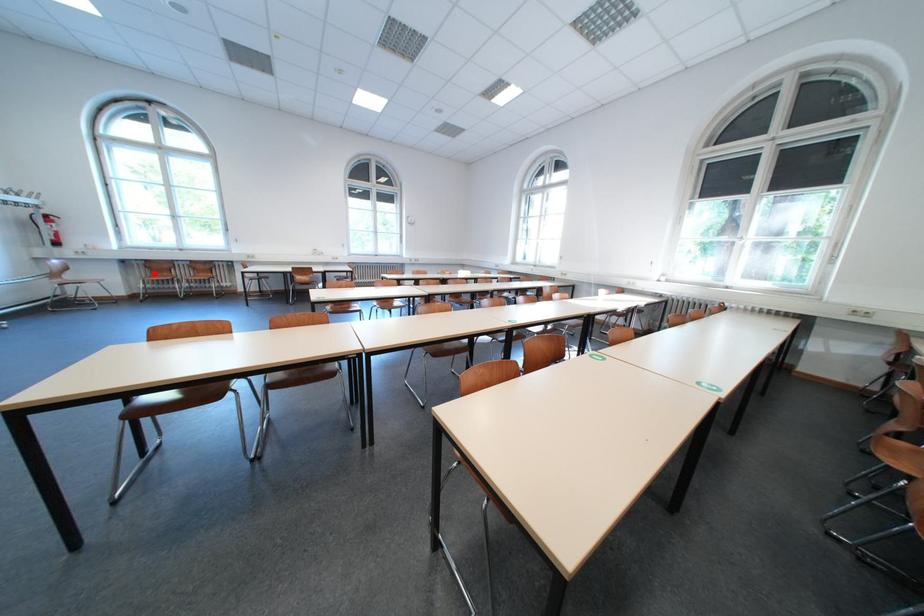
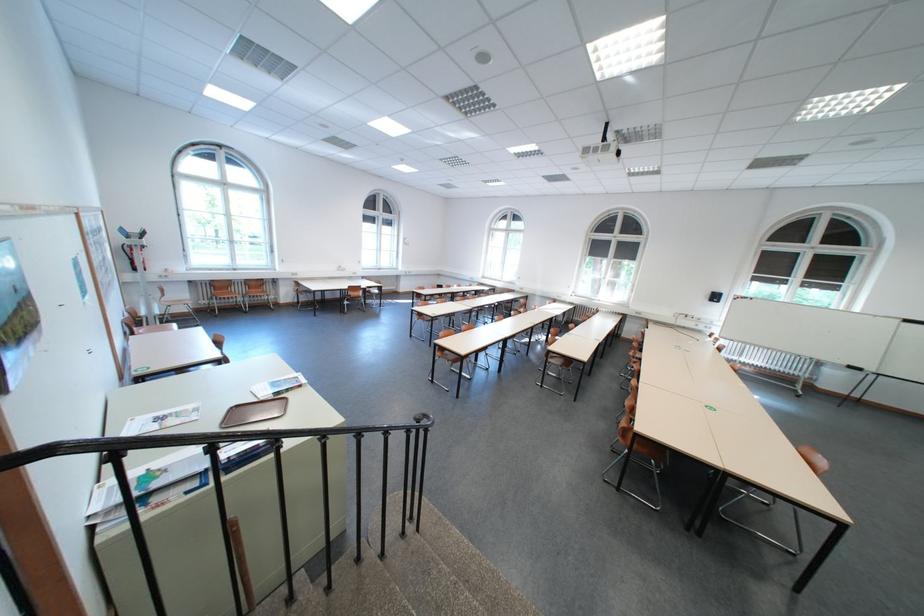
In the second image, find the point that corresponds to the highlighted location in the first image.

(219, 292)